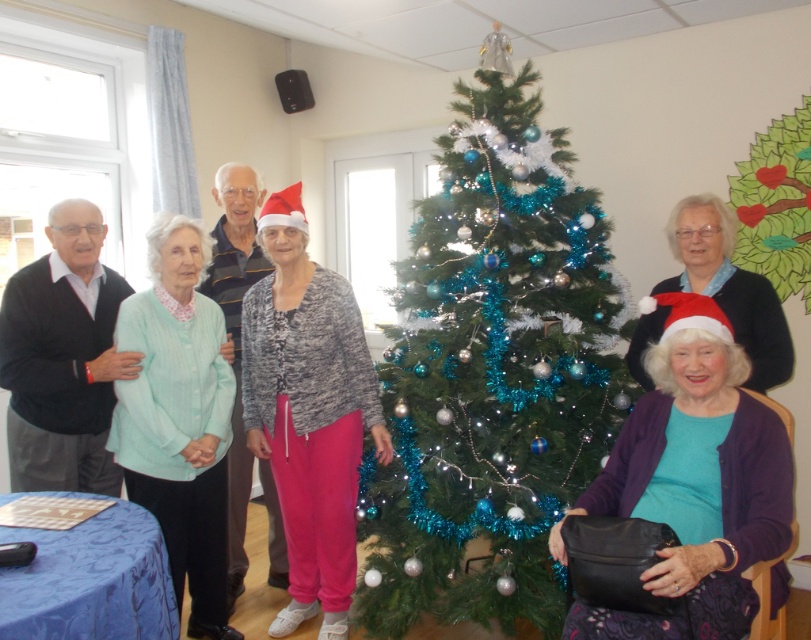
You are organizing a clothing donation drive and need to categorize sweaters by size. You have a purple soft sweater at center and a black sweater at left. Which sweater should you place in the large size bin?

The purple soft sweater at center should be placed in the large size bin since it has a larger size compared to the black sweater at left.

You are a photographer taking a group photo. You notice two sweaters on the left side of the image, a light green knitted sweater at left and a black sweater at left. Which one is taller?

The light green knitted sweater at left is taller than the black sweater at left.